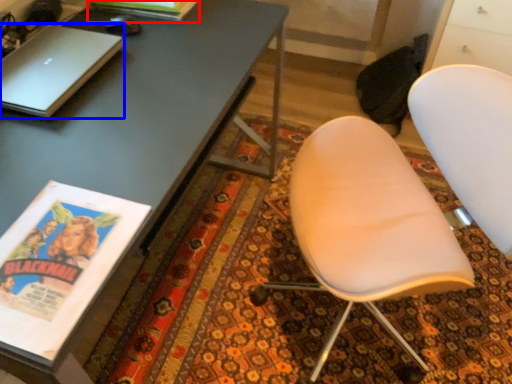
Question: Which object is closer to the camera taking this photo, magazine (highlighted by a red box) or laptop (highlighted by a blue box)?

Choices:
 (A) magazine
 (B) laptop

Answer: (B)